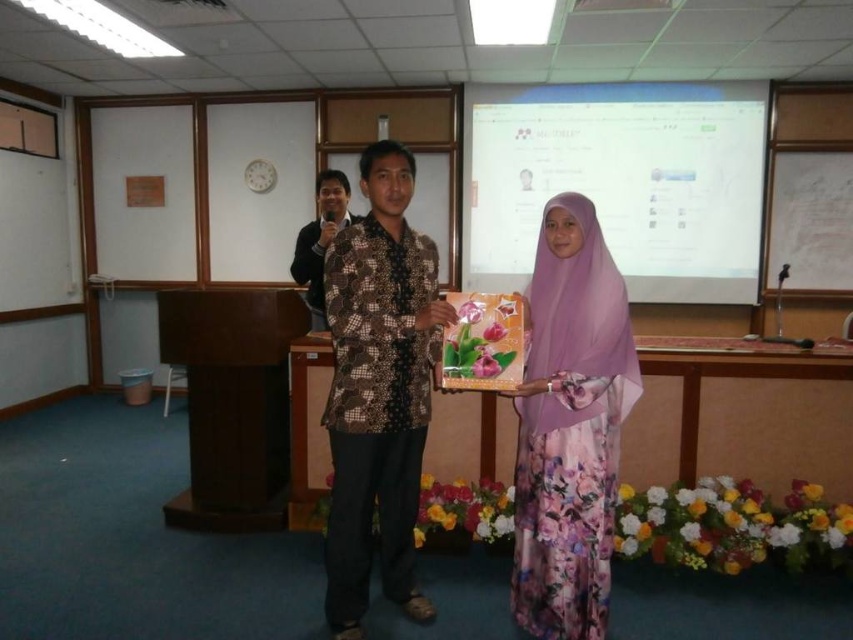
Question: In this image, where is floral-patterned dress at center located relative to purple floral dress at center?

Choices:
 (A) above
 (B) below

Answer: (A)

Question: Which point is farther to the camera?

Choices:
 (A) brown batik shirt at center
 (B) batik shirt at center

Answer: (B)

Question: Can you confirm if purple floral dress at center is positioned to the left of white paperboard at upper right?

Choices:
 (A) no
 (B) yes

Answer: (B)

Question: Which object is the closest to the purple floral dress at center?

Choices:
 (A) brown batik shirt at center
 (B) floral-patterned dress at center
 (C) white paperboard at upper right
 (D) batik shirt at center

Answer: (A)

Question: Can you confirm if purple floral dress at center is positioned above white paperboard at upper right?

Choices:
 (A) no
 (B) yes

Answer: (A)

Question: Which point is closer to the camera?

Choices:
 (A) floral-patterned dress at center
 (B) batik shirt at center

Answer: (A)